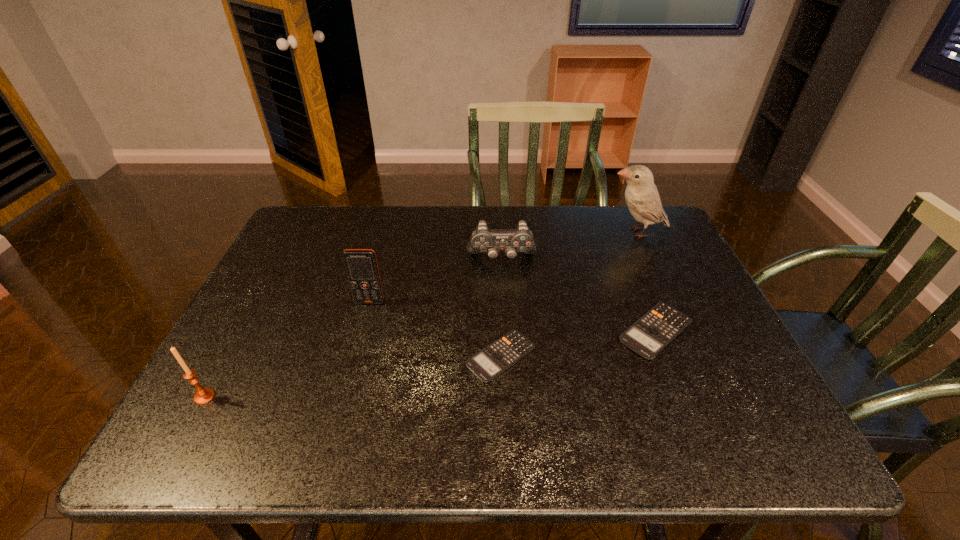
Please point a free position for a calculator on the left. Please provide its 2D coordinates. Your answer should be formatted as a tuple, i.e. [(x, y)], where the tuple contains the x and y coordinates of a point satisfying the conditions above.

[(328, 384)]